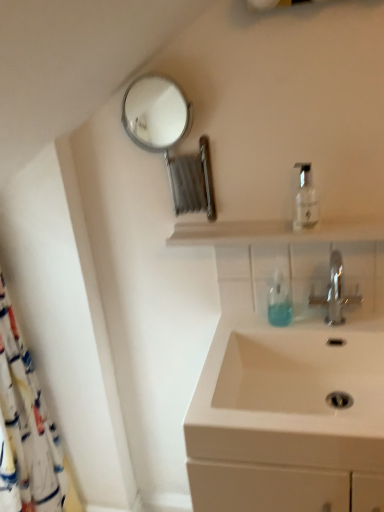
Question: Is metallic circular mirror at upper left oriented towards clear plastic bottle at upper right?

Choices:
 (A) no
 (B) yes

Answer: (A)

Question: Is metallic circular mirror at upper left directly adjacent to clear plastic bottle at upper right?

Choices:
 (A) yes
 (B) no

Answer: (B)

Question: From the image's perspective, is metallic circular mirror at upper left above clear plastic bottle at upper right?

Choices:
 (A) yes
 (B) no

Answer: (A)

Question: From the image's perspective, is metallic circular mirror at upper left under clear plastic bottle at upper right?

Choices:
 (A) yes
 (B) no

Answer: (B)

Question: From a real-world perspective, is metallic circular mirror at upper left on top of clear plastic bottle at upper right?

Choices:
 (A) yes
 (B) no

Answer: (A)

Question: Is metallic circular mirror at upper left smaller than clear plastic bottle at upper right?

Choices:
 (A) yes
 (B) no

Answer: (B)

Question: Is white ceramic sink at lower right taller than metallic circular mirror at upper left?

Choices:
 (A) yes
 (B) no

Answer: (B)

Question: Is white ceramic sink at lower right at the left side of metallic circular mirror at upper left?

Choices:
 (A) no
 (B) yes

Answer: (A)

Question: Is metallic circular mirror at upper left located within white ceramic sink at lower right?

Choices:
 (A) yes
 (B) no

Answer: (B)

Question: From the image's perspective, is white ceramic sink at lower right located beneath metallic circular mirror at upper left?

Choices:
 (A) yes
 (B) no

Answer: (A)

Question: From the image's perspective, is white ceramic sink at lower right on top of metallic circular mirror at upper left?

Choices:
 (A) no
 (B) yes

Answer: (A)

Question: Does white ceramic sink at lower right have a greater width compared to metallic circular mirror at upper left?

Choices:
 (A) yes
 (B) no

Answer: (A)

Question: Considering the relative sizes of metallic circular mirror at upper left and white fabric shower curtain at left in the image provided, is metallic circular mirror at upper left thinner than white fabric shower curtain at left?

Choices:
 (A) yes
 (B) no

Answer: (A)